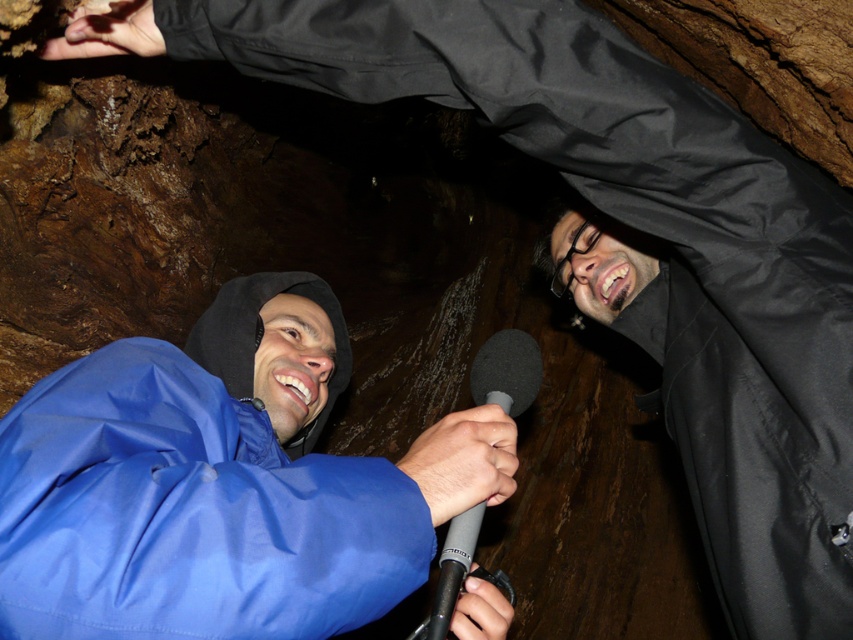
Question: Where is blue waterproof jacket at center located in relation to gray matte microphone at center in the image?

Choices:
 (A) below
 (B) above

Answer: (B)

Question: Which object appears closest to the camera in this image?

Choices:
 (A) gray matte microphone at center
 (B) blue waterproof jacket at center

Answer: (B)

Question: Is blue waterproof jacket at center below gray matte microphone at center?

Choices:
 (A) yes
 (B) no

Answer: (B)

Question: Can you confirm if blue waterproof jacket at center is positioned below gray matte microphone at center?

Choices:
 (A) yes
 (B) no

Answer: (B)